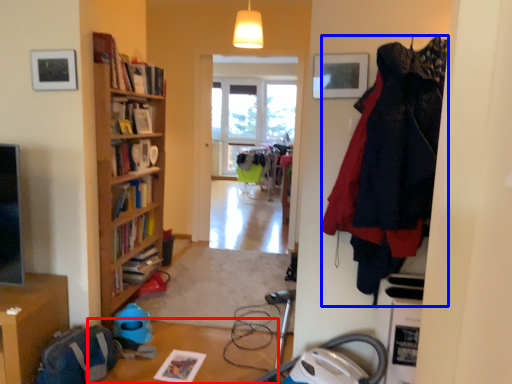
Question: Among these objects, which one is nearest to the camera, table (highlighted by a red box) or clothing (highlighted by a blue box)?

Choices:
 (A) table
 (B) clothing

Answer: (B)